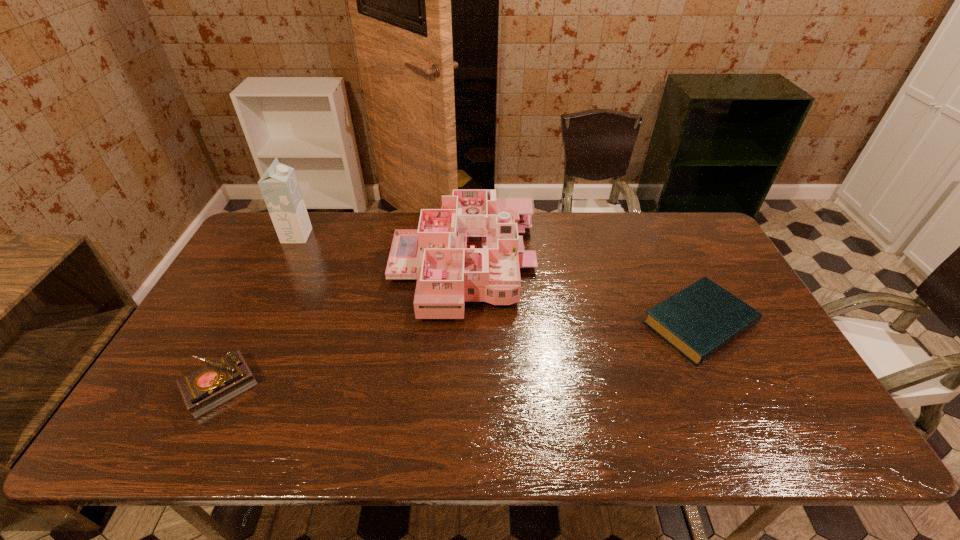
Locate an element on the screen. The image size is (960, 540). vacant area at the left edge is located at coordinates (276, 258).

Where is `free space at the right edge of the desktop`? free space at the right edge of the desktop is located at coordinates (733, 294).

Identify the location of vacant space at the far left corner. (268, 212).

At what (x,y) coordinates should I click in order to perform the action: click on free spot at the near left corner of the desktop. Please return your answer as a coordinate pair (x, y). Looking at the image, I should click on (168, 429).

Where is `free space at the far right corner of the desktop`? free space at the far right corner of the desktop is located at coordinates (700, 227).

The image size is (960, 540). What are the coordinates of `free space between the second object from right to left and the shortest object` in the screenshot? It's located at (582, 294).

At what (x,y) coordinates should I click in order to perform the action: click on free spot between the second shortest object and the shortest object. Please return your answer as a coordinate pair (x, y). The image size is (960, 540). Looking at the image, I should click on (460, 355).

The height and width of the screenshot is (540, 960). I want to click on vacant area that lies between the carton and the diary, so click(x=258, y=311).

Identify the location of free space between the second shortest object and the second tallest object. (342, 326).

Locate an element on the screen. The image size is (960, 540). free space between the book and the second tallest object is located at coordinates (582, 294).